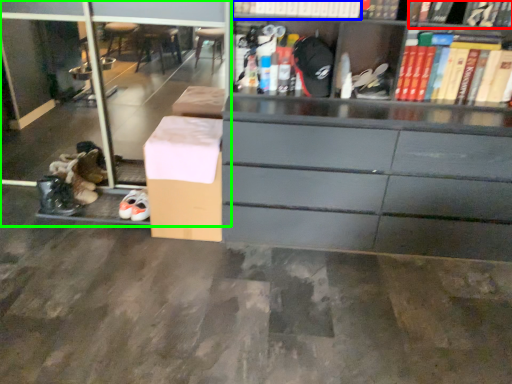
Question: Considering the real-world distances, which object is closest to book (highlighted by a red box)? book (highlighted by a blue box) or shelf (highlighted by a green box).

Choices:
 (A) book
 (B) shelf

Answer: (A)